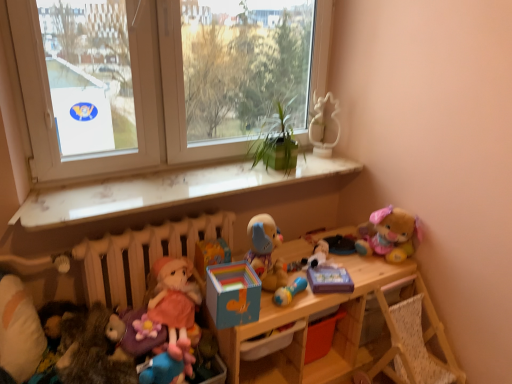
What are the coordinates of `vacant space situated on the left part of fluffy plush bear at upper right, placed as the 7th toy when sorted from left to right` in the screenshot? It's located at (349, 259).